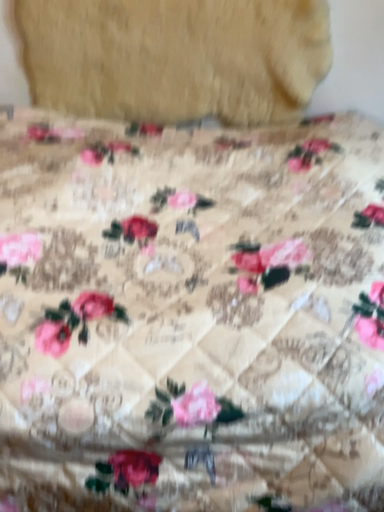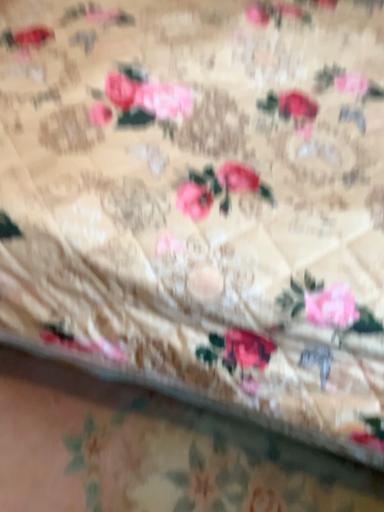
Question: How did the camera likely rotate when shooting the video?

Choices:
 (A) rotated right
 (B) rotated left

Answer: (B)